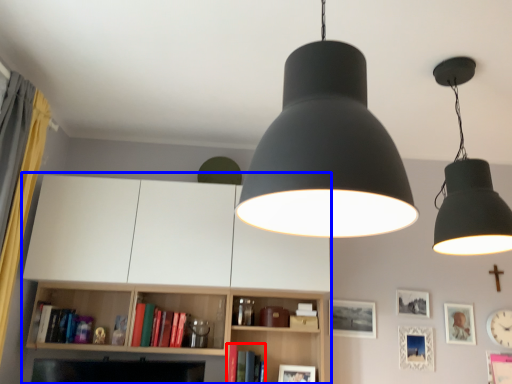
Question: Among these objects, which one is nearest to the camera, book (highlighted by a red box) or entertainment center (highlighted by a blue box)?

Choices:
 (A) book
 (B) entertainment center

Answer: (B)